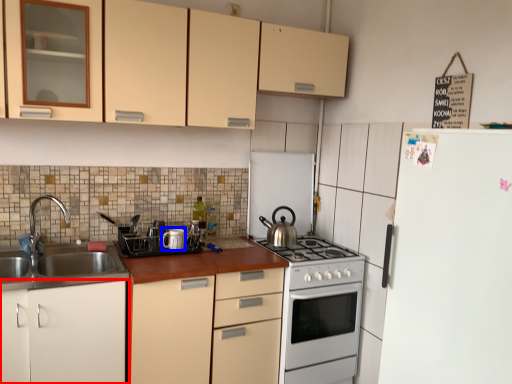
Question: Which of the following is the farthest to the observer, cabinetry (highlighted by a red box) or appliance (highlighted by a blue box)?

Choices:
 (A) cabinetry
 (B) appliance

Answer: (B)